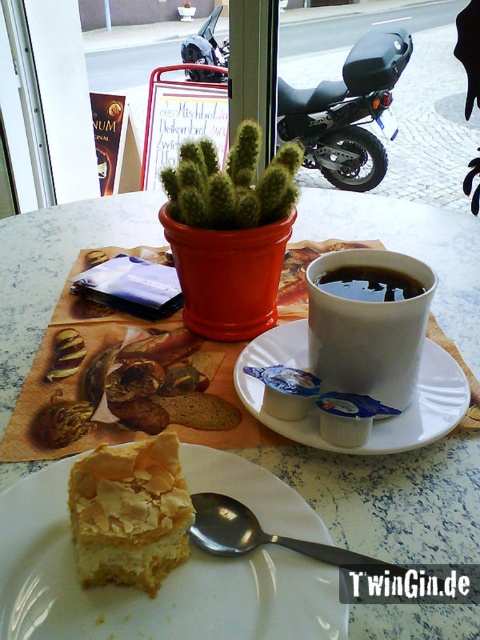
You are a delivery person trying to place a narrow package on the table. The package is exactly as thin as the white marble table at center. Can you place it on the black matte motorcycle at upper center without it hanging over the edge?

The white marble table at center is thinner than the black matte motorcycle at upper center. Since the package is as thin as the white marble table at center, it would be too wide for the black matte motorcycle at upper center, causing it to hang over the edge.